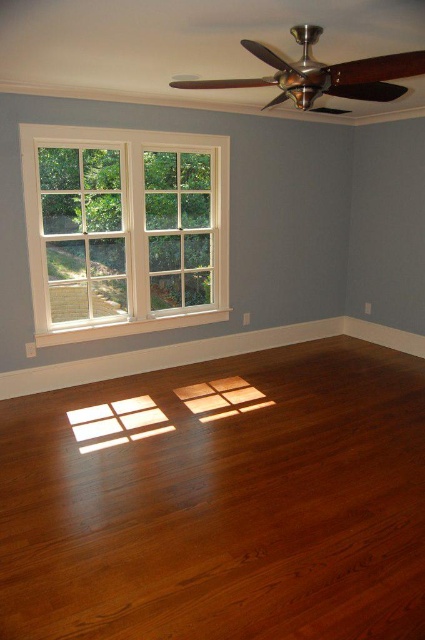
Question: Does shiny brown hardwood floor at center lie in front of white painted wood window at left?

Choices:
 (A) no
 (B) yes

Answer: (B)

Question: Is shiny brown hardwood floor at center to the right of white painted wood window at left from the viewer's perspective?

Choices:
 (A) yes
 (B) no

Answer: (A)

Question: Which point appears farthest from the camera in this image?

Choices:
 (A) tap(125, 204)
 (B) tap(234, 426)

Answer: (A)

Question: Does shiny brown hardwood floor at center come behind white painted wood window at left?

Choices:
 (A) yes
 (B) no

Answer: (B)

Question: Which point is closer to the camera?

Choices:
 (A) white painted wood window at left
 (B) shiny brown hardwood floor at center

Answer: (B)